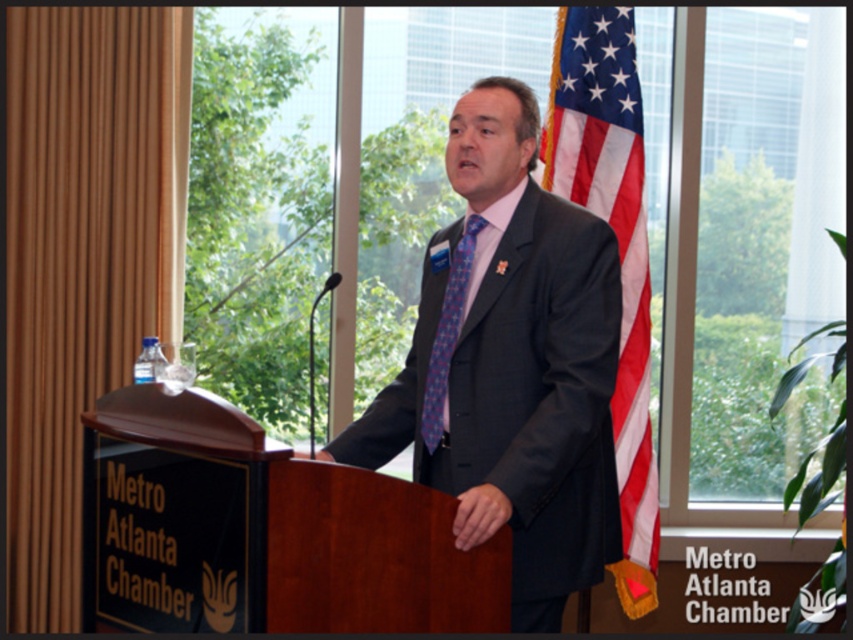
Does american flag at right appear on the right side of blue textured tie at center?

Yes, american flag at right is to the right of blue textured tie at center.

The height and width of the screenshot is (640, 853). What do you see at coordinates (618, 246) in the screenshot?
I see `american flag at right` at bounding box center [618, 246].

Where is `american flag at right`? This screenshot has width=853, height=640. american flag at right is located at coordinates (618, 246).

Is point (511, 108) positioned before point (573, 129)?

Yes, it is in front of point (573, 129).

At what (x,y) coordinates should I click in order to perform the action: click on dark gray suit at center. Please return your answer as a coordinate pair (x, y). Looking at the image, I should click on (509, 364).

Where is `dark gray suit at center`? This screenshot has width=853, height=640. dark gray suit at center is located at coordinates (509, 364).

Between dark gray suit at center and blue textured tie at center, which one appears on the right side from the viewer's perspective?

dark gray suit at center is more to the right.

Between point (556, 294) and point (463, 262), which one is positioned in front?

Point (556, 294) is in front.

Identify the location of dark gray suit at center. This screenshot has width=853, height=640. (509, 364).